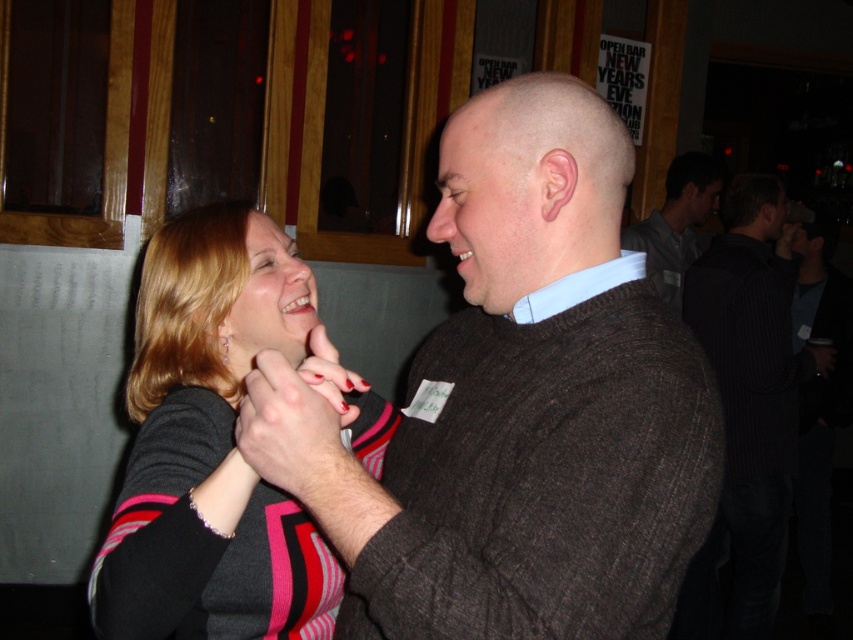
Looking at this image, you are a photographer at a social event and need to capture a clear shot of the dark brown sweater at center and the striped sweater at center. Which one is covering the other in the image?

The dark brown sweater at center is positioned over the striped sweater at center, so it is covering the striped sweater at center.

From the picture: You are an event planner trying to place a name tag on the dark brown sweater at center. What are the coordinates where you should place the name tag?

The name tag should be placed at the 2D location of the dark brown sweater at center, which is at point [518,408].

You are at a party and want to borrow a sweater that is larger than the one you are currently wearing. You see the black pinstripe sweater at right and the dark gray sweater at center. Which one should you choose?

The black pinstripe sweater at right is bigger than the dark gray sweater at center, so you should choose the black pinstripe sweater at right.